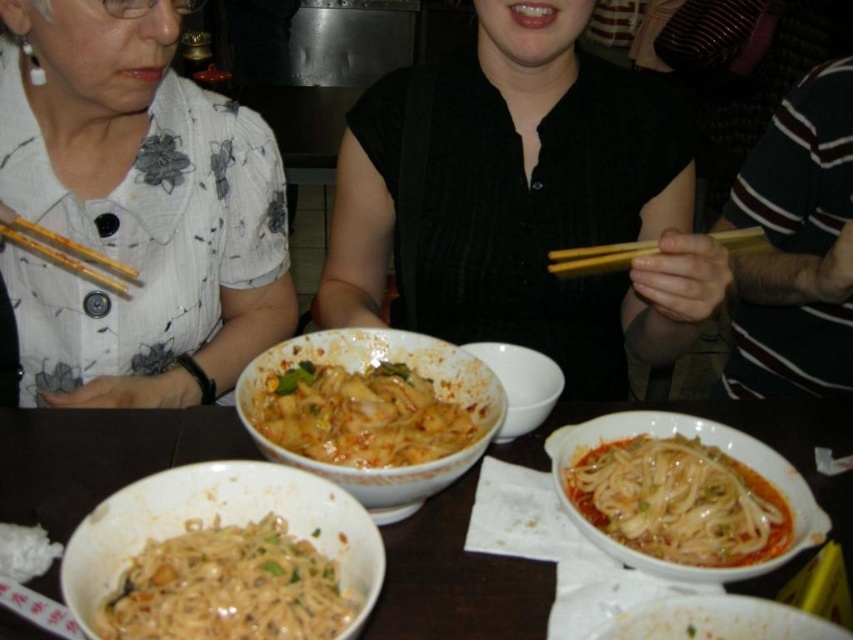
Question: Which object is positioned closest to the matte ceramic bowl at center?

Choices:
 (A) black matte dress at center
 (B) wooden chopsticks at left
 (C) white floral shirt at left

Answer: (A)

Question: Can you confirm if white glossy bowl at lower left is positioned to the left of matte ceramic bowl at center?

Choices:
 (A) no
 (B) yes

Answer: (B)

Question: Where is matte white bowl at lower center located in relation to matte ceramic bowl at center in the image?

Choices:
 (A) above
 (B) below

Answer: (B)

Question: Which point appears closest to the camera in this image?

Choices:
 (A) (102, 280)
 (B) (378, 170)
 (C) (218, 193)
 (D) (112, 545)

Answer: (D)

Question: Based on their relative distances, which object is nearer to the matte ceramic bowl at center?

Choices:
 (A) black matte dress at center
 (B) wooden chopsticks at left
 (C) matte white bowl at lower center

Answer: (A)

Question: Is the position of black matte dress at center less distant than that of slightly glossy white noodles at center?

Choices:
 (A) yes
 (B) no

Answer: (B)